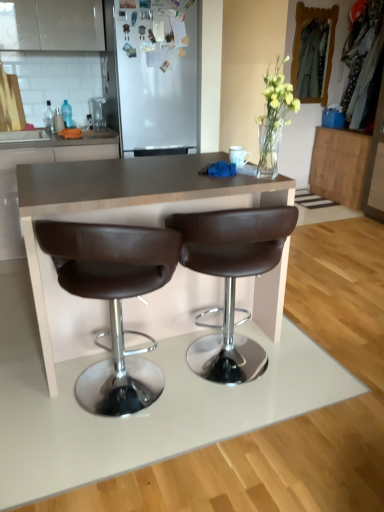
The width and height of the screenshot is (384, 512). I want to click on vacant space in front of brown leather stool at center, the 2th chair positioned from the left, so click(245, 440).